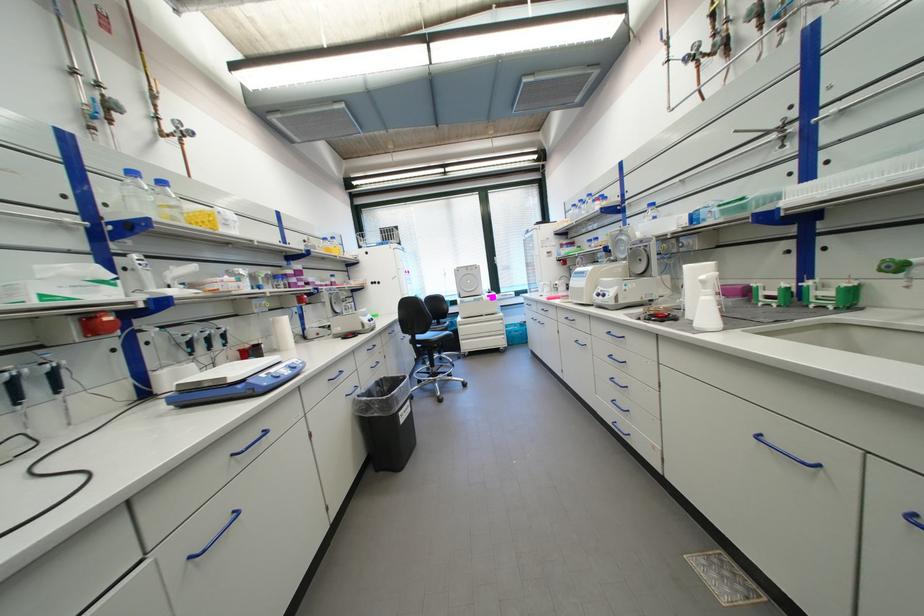
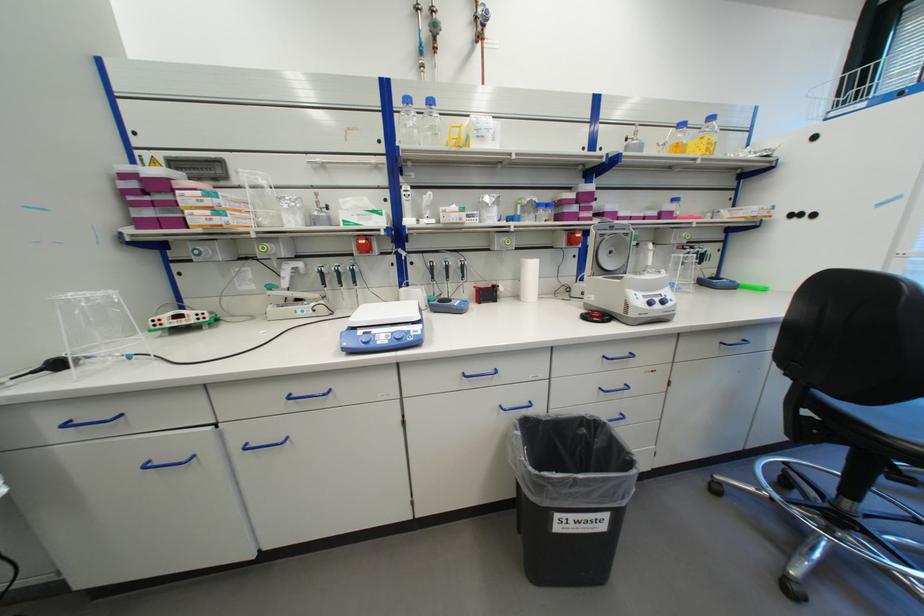
In the second image, find the point that corresponds to pixel 156 180 in the first image.

(428, 103)